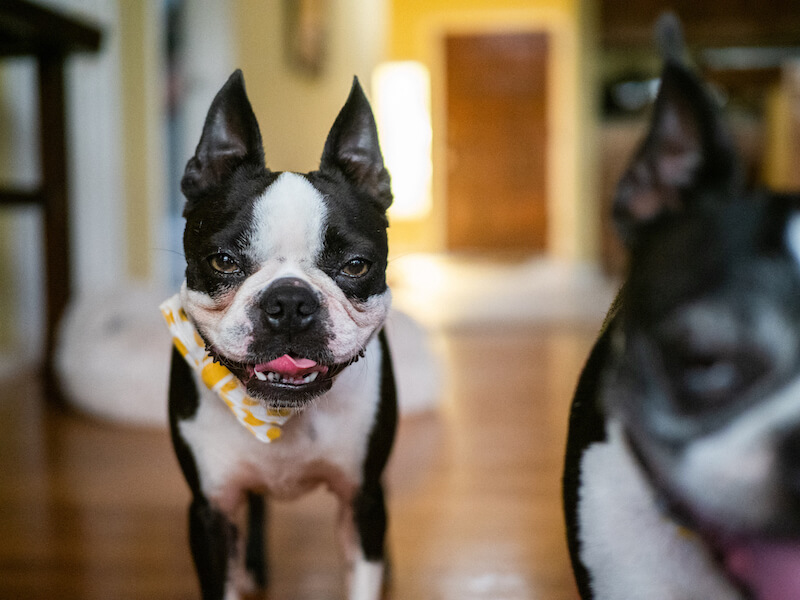
The height and width of the screenshot is (600, 800). What are the coordinates of `door frame` in the screenshot? It's located at (560, 71), (557, 219), (488, 27), (440, 93), (440, 166).